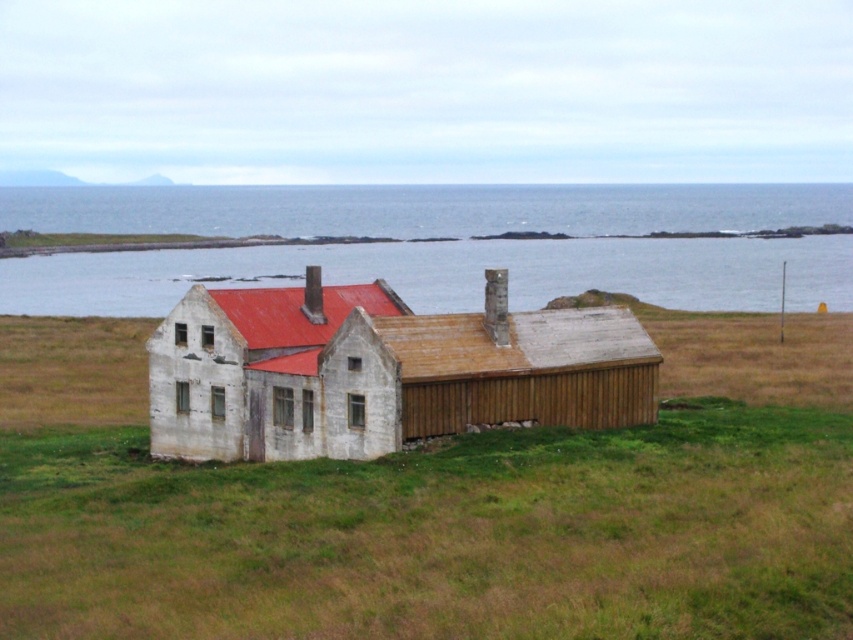
What do you see at coordinates (439, 244) in the screenshot?
I see `transparent water at center` at bounding box center [439, 244].

Measure the distance between point (576,236) and camera.

Point (576,236) is 201.97 meters away from camera.

At what (x,y) coordinates should I click in order to perform the action: click on transparent water at center. Please return your answer as a coordinate pair (x, y). This screenshot has width=853, height=640. Looking at the image, I should click on tap(439, 244).